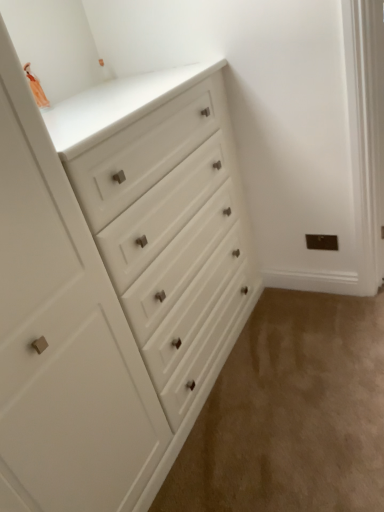
Question: In the image, is beige carpet at lower right on the left side or the right side of white matte chest of drawers at upper left?

Choices:
 (A) right
 (B) left

Answer: (A)

Question: Choose the correct answer: Is beige carpet at lower right inside white matte chest of drawers at upper left or outside it?

Choices:
 (A) inside
 (B) outside

Answer: (B)

Question: From a real-world perspective, is beige carpet at lower right positioned above or below white matte chest of drawers at upper left?

Choices:
 (A) above
 (B) below

Answer: (B)

Question: Visually, is white matte chest of drawers at upper left positioned to the left or to the right of beige carpet at lower right?

Choices:
 (A) left
 (B) right

Answer: (A)

Question: From their relative heights in the image, would you say white matte chest of drawers at upper left is taller or shorter than beige carpet at lower right?

Choices:
 (A) short
 (B) tall

Answer: (B)

Question: From a real-world perspective, relative to beige carpet at lower right, is white matte chest of drawers at upper left vertically above or below?

Choices:
 (A) below
 (B) above

Answer: (B)

Question: In the image, is white matte chest of drawers at upper left positioned in front of or behind beige carpet at lower right?

Choices:
 (A) front
 (B) behind

Answer: (A)